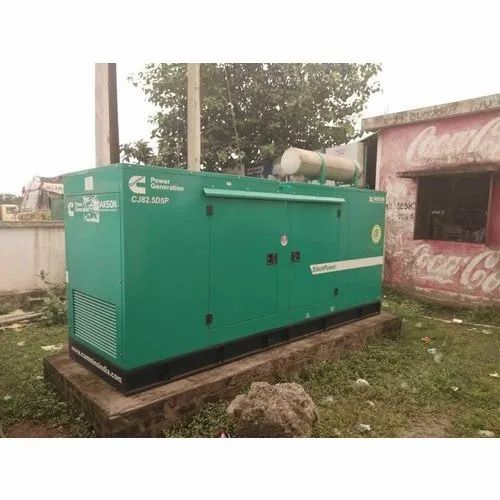
Locate an element on the screen. This screenshot has height=500, width=500. wall is located at coordinates (31, 259).